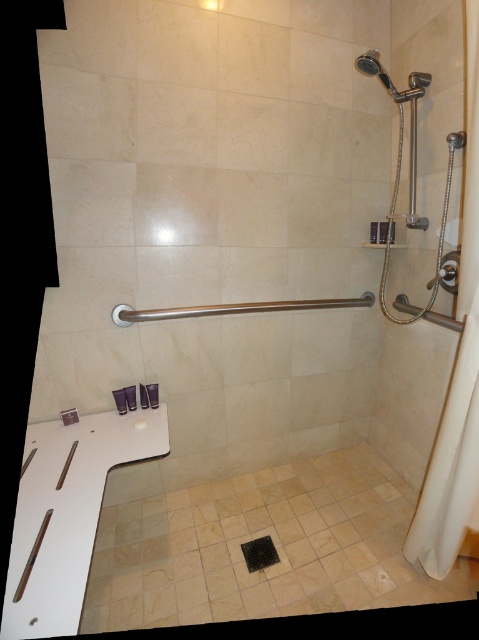
From the picture: You are standing in the shower area and need to reach the matte silver showerhead at upper right to adjust the water temperature. Is the white fabric shower curtain at right blocking your direct line of sight to the showerhead?

The white fabric shower curtain at right is closer to the viewer than the matte silver showerhead at upper right, so it may block your direct line of sight to the showerhead.

You are designing a layout for a shower and need to ensure proper spacing between the white fabric shower curtain at right and the satin nickel towel bar at center. Given their height difference, which object should be placed lower to maintain balance?

The satin nickel towel bar at center should be placed lower since the white fabric shower curtain at right is much taller, balancing their visual weight by adjusting their vertical positions.